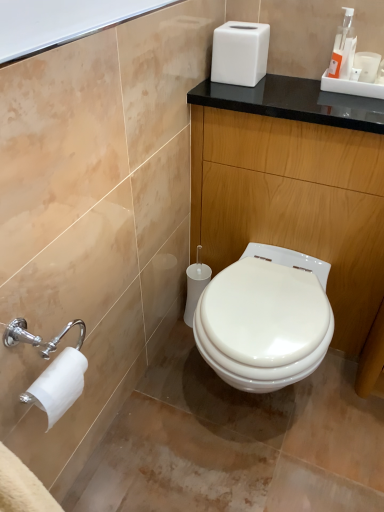
Question: From the image's perspective, is white matte tissue box at upper center located above black glossy counter at center?

Choices:
 (A) yes
 (B) no

Answer: (A)

Question: Are white matte tissue box at upper center and black glossy counter at center far apart?

Choices:
 (A) no
 (B) yes

Answer: (A)

Question: Considering the relative sizes of white matte tissue box at upper center and black glossy counter at center in the image provided, is white matte tissue box at upper center thinner than black glossy counter at center?

Choices:
 (A) yes
 (B) no

Answer: (A)

Question: From a real-world perspective, is white matte tissue box at upper center on black glossy counter at center?

Choices:
 (A) no
 (B) yes

Answer: (B)

Question: Is white matte tissue box at upper center oriented towards black glossy counter at center?

Choices:
 (A) yes
 (B) no

Answer: (B)

Question: Does white matte tissue box at upper center touch black glossy counter at center?

Choices:
 (A) yes
 (B) no

Answer: (B)

Question: Considering the relative positions of orange plastic soap dispenser at upper right and white matte toilet paper at lower left in the image provided, is orange plastic soap dispenser at upper right to the right of white matte toilet paper at lower left from the viewer's perspective?

Choices:
 (A) yes
 (B) no

Answer: (A)

Question: Is orange plastic soap dispenser at upper right touching white matte toilet paper at lower left?

Choices:
 (A) yes
 (B) no

Answer: (B)

Question: Would you say orange plastic soap dispenser at upper right is outside white matte toilet paper at lower left?

Choices:
 (A) yes
 (B) no

Answer: (A)

Question: Can you confirm if orange plastic soap dispenser at upper right is taller than white matte toilet paper at lower left?

Choices:
 (A) no
 (B) yes

Answer: (B)

Question: Does orange plastic soap dispenser at upper right have a smaller size compared to white matte toilet paper at lower left?

Choices:
 (A) yes
 (B) no

Answer: (A)

Question: Is white matte toilet paper at lower left at the back of orange plastic soap dispenser at upper right?

Choices:
 (A) no
 (B) yes

Answer: (A)

Question: Does white matte toilet paper at lower left have a lesser width compared to orange plastic soap dispenser at upper right?

Choices:
 (A) yes
 (B) no

Answer: (A)